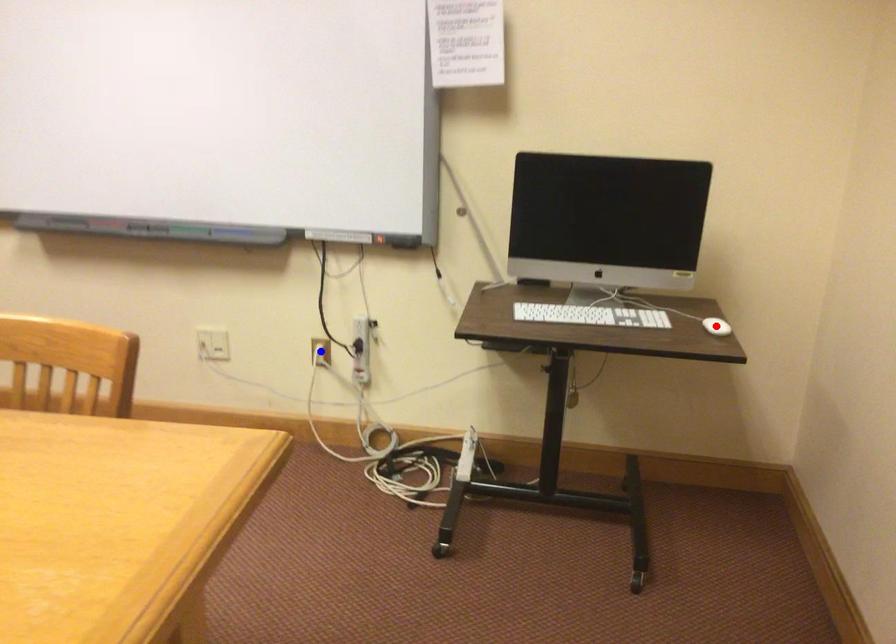
Question: Two points are marked on the image. Which point is closer to the camera?

Choices:
 (A) Blue point is closer.
 (B) Red point is closer.

Answer: (B)